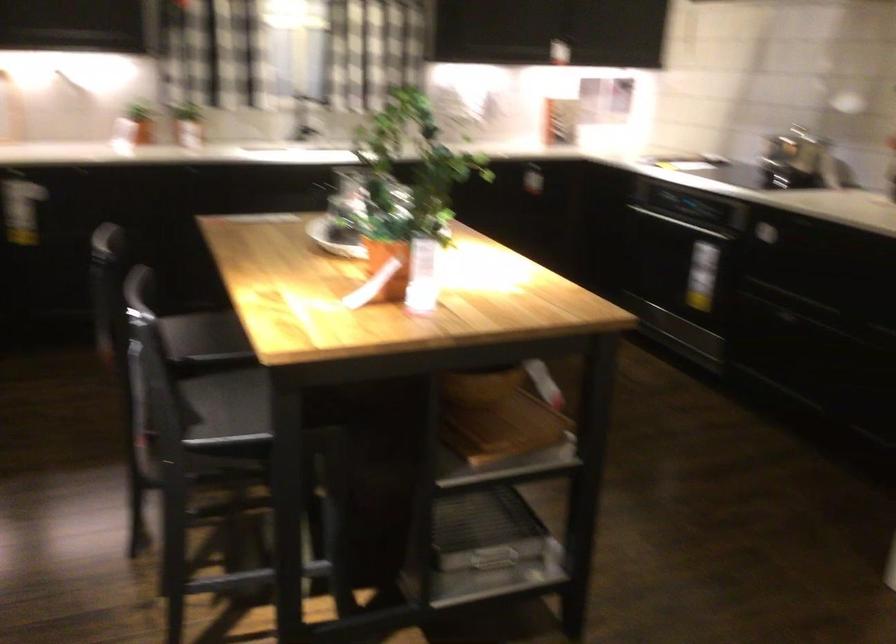
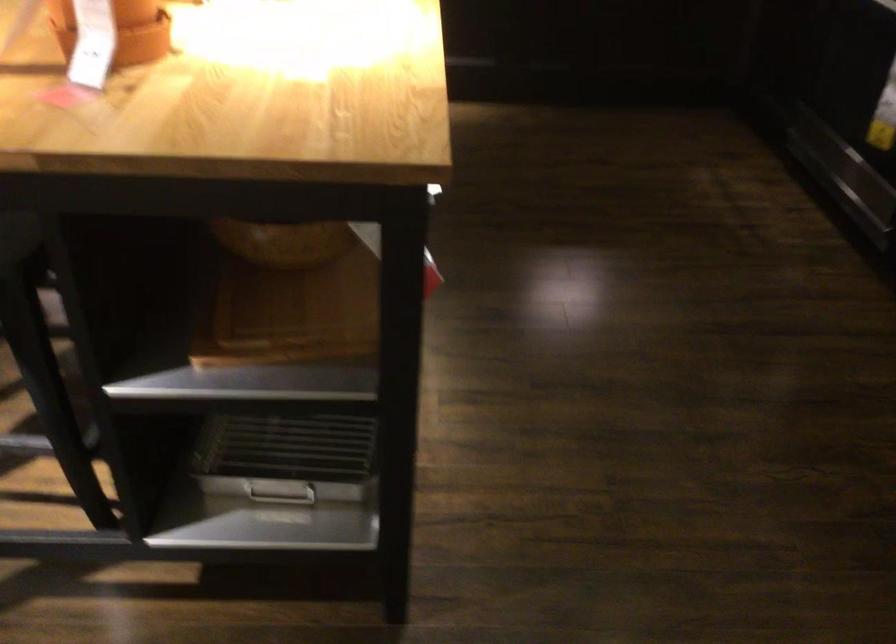
In the scene shown: The images are taken continuously from a first-person perspective. In which direction are you moving?

The movement direction of the cameraman is right, forward.